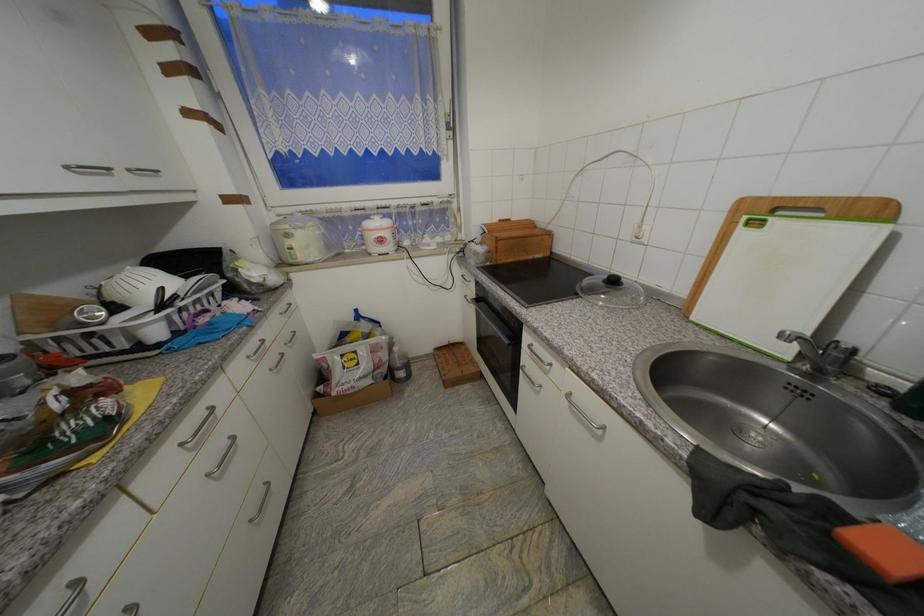
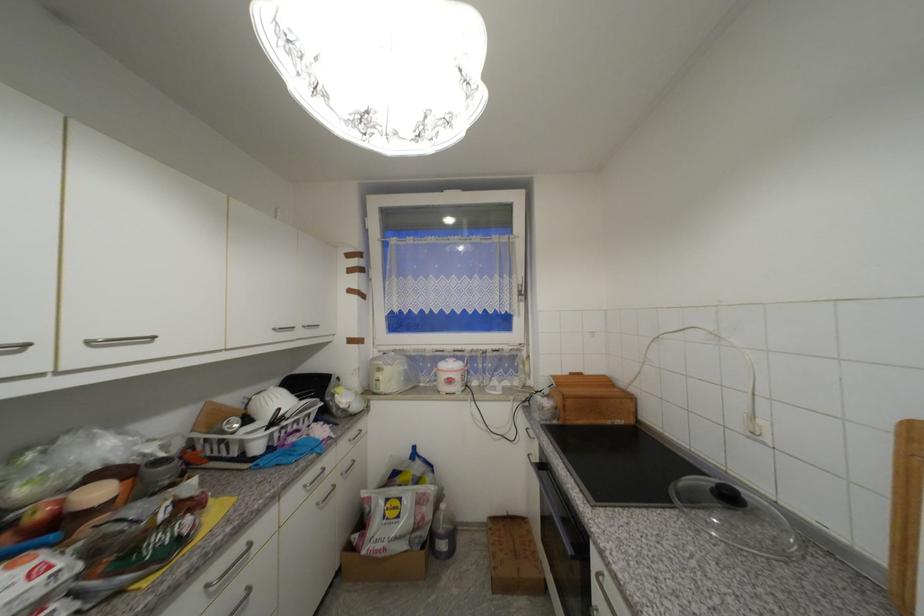
In the second image, find the point that corresponds to (x=74, y=169) in the first image.

(281, 331)